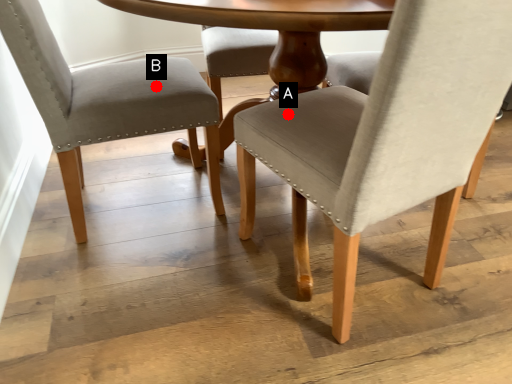
Question: Two points are circled on the image, labeled by A and B beside each circle. Which point is farther to the camera?

Choices:
 (A) A is further
 (B) B is further

Answer: (B)